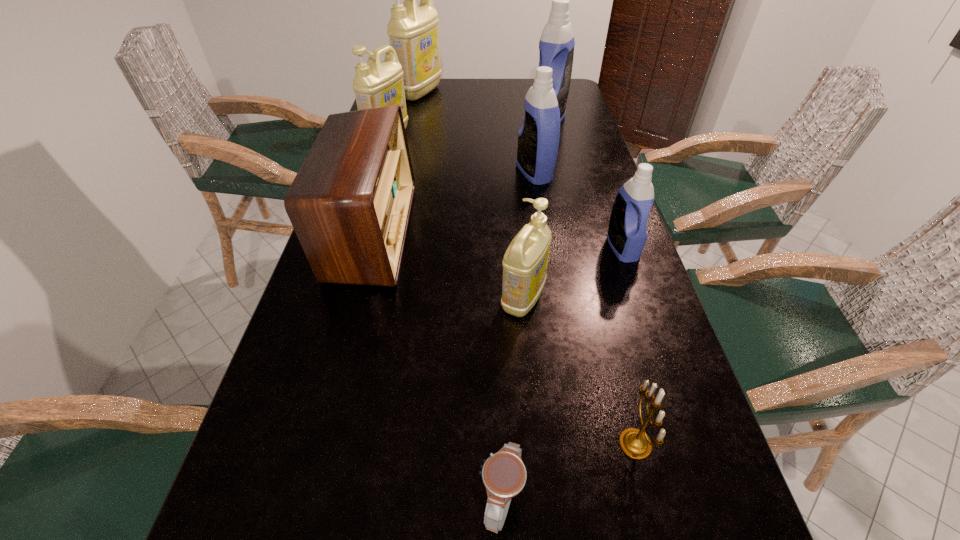
Locate an element on the screen. the rightmost detergent is located at coordinates (627, 234).

Find the location of a particular element. The height and width of the screenshot is (540, 960). the second shortest object is located at coordinates (634, 442).

At what (x,y) coordinates should I click in order to perform the action: click on gold candelabrum. Please return your answer as a coordinate pair (x, y). This screenshot has height=540, width=960. Looking at the image, I should click on (634, 442).

At what (x,y) coordinates should I click in order to perform the action: click on free region located on the right of the farthest beige detergent. Please return your answer as a coordinate pair (x, y). The height and width of the screenshot is (540, 960). Looking at the image, I should click on (516, 92).

Image resolution: width=960 pixels, height=540 pixels. Identify the location of free space located on the front of the biggest blue detergent. (560, 171).

Locate an element on the screen. vacant space situated 0.360m on the right of the second biggest beige detergent is located at coordinates (517, 138).

Where is `vacant point located on the right of the fourth farthest detergent`? The height and width of the screenshot is (540, 960). vacant point located on the right of the fourth farthest detergent is located at coordinates (592, 173).

Identify the location of vacant space situated on the front-facing side of the radio receiver. The height and width of the screenshot is (540, 960). (464, 232).

Identify the location of free spot located 0.350m on the left of the nearest detergent. The width and height of the screenshot is (960, 540). (337, 299).

The width and height of the screenshot is (960, 540). In order to click on vacant space located 0.400m on the back of the rightmost blue detergent in this screenshot , I will do `click(589, 152)`.